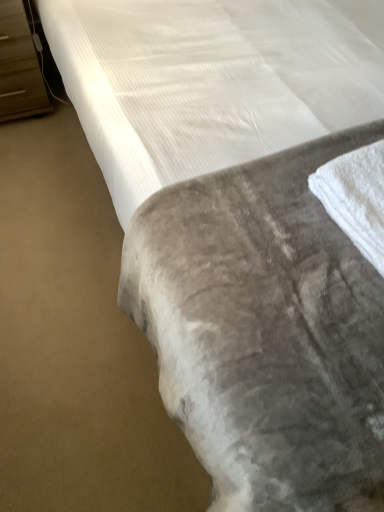
Question: From the image's perspective, is brown wood dresser at left located beneath white soft towel at lower right?

Choices:
 (A) yes
 (B) no

Answer: (B)

Question: Is brown wood dresser at left bigger than white soft towel at lower right?

Choices:
 (A) yes
 (B) no

Answer: (A)

Question: Is brown wood dresser at left far away from white soft towel at lower right?

Choices:
 (A) no
 (B) yes

Answer: (B)

Question: Is brown wood dresser at left completely or partially outside of white soft towel at lower right?

Choices:
 (A) yes
 (B) no

Answer: (A)

Question: Is brown wood dresser at left next to white soft towel at lower right and touching it?

Choices:
 (A) no
 (B) yes

Answer: (A)

Question: Is brown wood dresser at left closer to camera compared to white soft towel at lower right?

Choices:
 (A) yes
 (B) no

Answer: (B)

Question: Can you confirm if white soft towel at lower right is thinner than brown wood dresser at left?

Choices:
 (A) no
 (B) yes

Answer: (B)

Question: From the image's perspective, is white soft towel at lower right over brown wood dresser at left?

Choices:
 (A) no
 (B) yes

Answer: (A)

Question: Is white soft towel at lower right outside of brown wood dresser at left?

Choices:
 (A) yes
 (B) no

Answer: (A)

Question: From a real-world perspective, is white soft towel at lower right positioned under brown wood dresser at left based on gravity?

Choices:
 (A) no
 (B) yes

Answer: (A)

Question: Would you consider white soft towel at lower right to be distant from brown wood dresser at left?

Choices:
 (A) no
 (B) yes

Answer: (B)

Question: Is brown wood dresser at left at the back of white soft towel at lower right?

Choices:
 (A) no
 (B) yes

Answer: (B)

Question: Choose the correct answer: Is white soft towel at lower right inside brown wood dresser at left or outside it?

Choices:
 (A) outside
 (B) inside

Answer: (A)